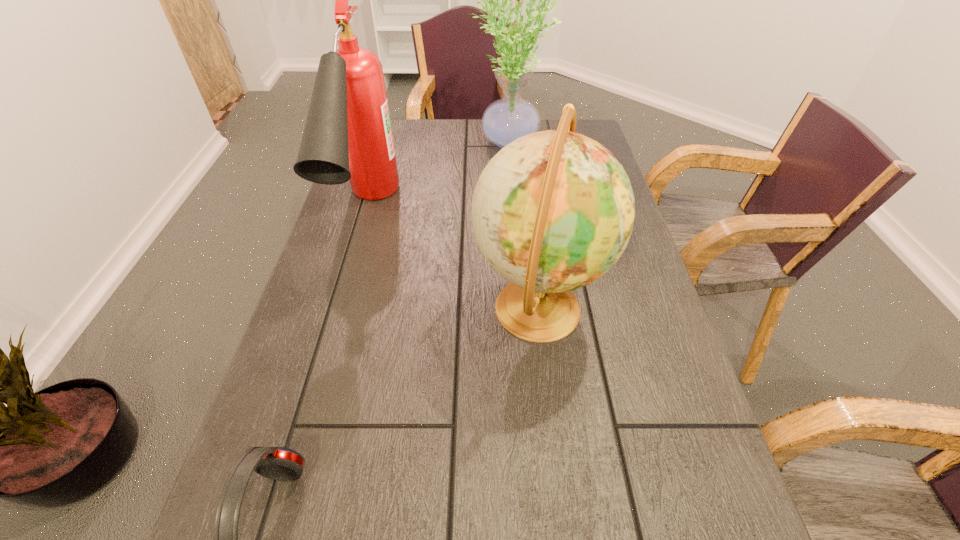
The width and height of the screenshot is (960, 540). In order to click on vacant space at the left edge in this screenshot , I will do `click(339, 242)`.

Identify the location of free space at the right edge of the desktop. (685, 528).

Locate an element on the screen. This screenshot has width=960, height=540. free region at the far right corner of the desktop is located at coordinates (549, 125).

At what (x,y) coordinates should I click in order to perform the action: click on unoccupied position between the fire extinguisher and the flower arrangement. Please return your answer as a coordinate pair (x, y). Looking at the image, I should click on (436, 178).

The width and height of the screenshot is (960, 540). Identify the location of free space between the globe and the fire extinguisher. (453, 261).

Where is `vacant area that lies between the fire extinguisher and the globe`? The height and width of the screenshot is (540, 960). vacant area that lies between the fire extinguisher and the globe is located at coordinates (453, 261).

This screenshot has width=960, height=540. In order to click on the closest object to the globe in this screenshot , I will do `click(347, 136)`.

Select which object is the third closest to the globe. Please provide its 2D coordinates. Your answer should be formatted as a tuple, i.e. [(x, y)], where the tuple contains the x and y coordinates of a point satisfying the conditions above.

[(504, 120)]

Where is `free location that satisfies the following two spatial constraints: 1. at the nozzle of the globe; 2. on the left side of the fire extinguisher`? This screenshot has width=960, height=540. free location that satisfies the following two spatial constraints: 1. at the nozzle of the globe; 2. on the left side of the fire extinguisher is located at coordinates 343,308.

The image size is (960, 540). In order to click on vacant space that satisfies the following two spatial constraints: 1. on the front side of the flower arrangement; 2. on the right side of the globe in this screenshot , I will do `click(516, 308)`.